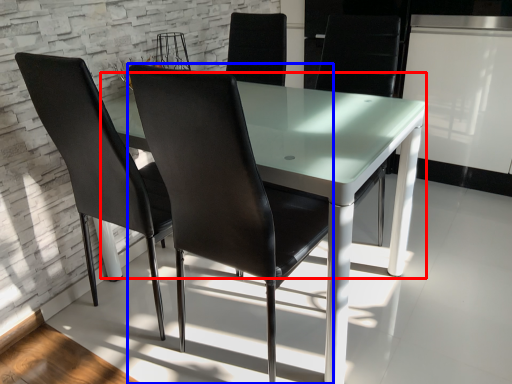
Question: Which of the following is the closest to the observer, round table (highlighted by a red box) or chair (highlighted by a blue box)?

Choices:
 (A) round table
 (B) chair

Answer: (B)